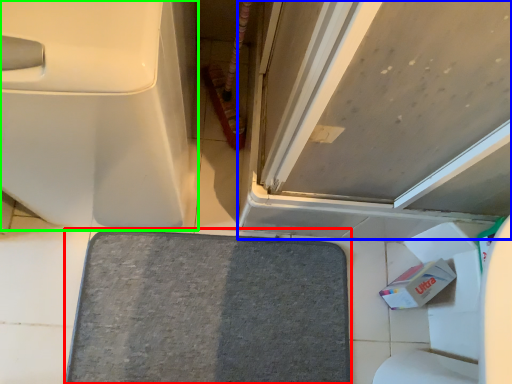
Question: Which is nearer to the bath mat (highlighted by a red box)? door (highlighted by a blue box) or toilet (highlighted by a green box).

Choices:
 (A) door
 (B) toilet

Answer: (A)